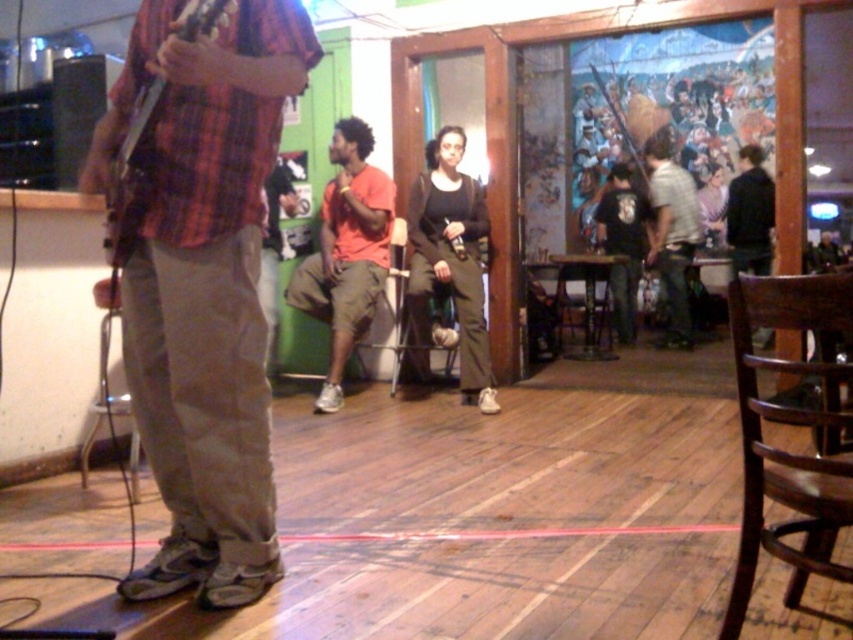
You are a photographer trying to capture a closeup shot of the plaid fabric shirt at left and the wooden acoustic guitar at left. Your camera can focus on objects within 8 inches. Can you focus on both objects at the same time?

The plaid fabric shirt at left is 9.10 inches from the wooden acoustic guitar at left. Since the distance between them exceeds the camera focus range of 8 inches, you cannot focus on both objects simultaneously.

You are a photographer setting up for a live performance. You need to position a camera to capture both the plaid fabric shirt at left and the wooden acoustic guitar at left without cropping either. Based on the scene, which object should you ensure has more space allocated in the frame?

The plaid fabric shirt at left might be wider than the wooden acoustic guitar at left, so you should allocate more space for the plaid fabric shirt at left to ensure it is fully captured in the frame.

You are a photographer setting up a camera to capture the scene. You need to adjust the focus so that both the plaid fabric shirt at left and the wooden acoustic guitar at left are in clear view. Which object should you focus on first to ensure both are in focus?

The plaid fabric shirt at left has a greater height compared to the wooden acoustic guitar at left, so focusing on the taller plaid fabric shirt at left first will ensure both are in focus.